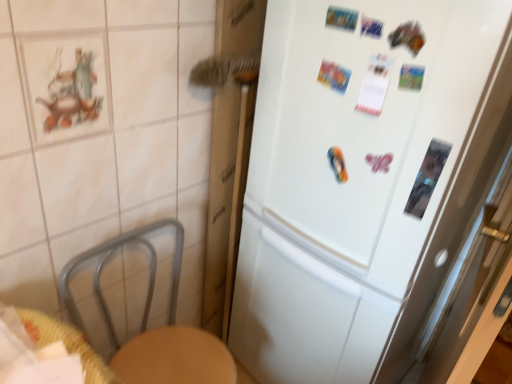
Measure the distance between transparent glass screen door at right and camera.

transparent glass screen door at right and camera are 72.40 centimeters apart from each other.

What do you see at coordinates (362, 177) in the screenshot? The height and width of the screenshot is (384, 512). I see `white matte refrigerator at center` at bounding box center [362, 177].

Locate an element on the screen. woven wood table at lower left is located at coordinates tap(66, 343).

You are a GUI agent. You are given a task and a screenshot of the screen. Output one action in this format:
    pyautogui.click(x=<x>, y=<y>)
    Task: Click on the transparent glass screen door at right
    The width and height of the screenshot is (512, 384).
    Given the screenshot: What is the action you would take?
    pyautogui.click(x=471, y=280)

Is woven wood table at lower left at the right side of transparent glass screen door at right?

No, woven wood table at lower left is not to the right of transparent glass screen door at right.

Does point (91, 367) appear closer or farther from the camera than point (457, 337)?

Point (91, 367) is closer to the camera than point (457, 337).

Is woven wood table at lower left far away from transparent glass screen door at right?

No, woven wood table at lower left is not far away from transparent glass screen door at right.

Considering the relative sizes of woven wood table at lower left and transparent glass screen door at right in the image provided, is woven wood table at lower left wider than transparent glass screen door at right?

Indeed, woven wood table at lower left has a greater width compared to transparent glass screen door at right.

How many degrees apart are the facing directions of transparent glass screen door at right and white matte refrigerator at center?

They differ by 108 degrees in their facing directions.

Is transparent glass screen door at right inside the boundaries of white matte refrigerator at center, or outside?

transparent glass screen door at right is not inside white matte refrigerator at center, it's outside.

Locate an element on the screen. screen door in front of the white matte refrigerator at center is located at coordinates pyautogui.click(x=471, y=280).

From a real-world perspective, does transparent glass screen door at right sit lower than white matte refrigerator at center?

Indeed, from a real-world perspective, transparent glass screen door at right is positioned beneath white matte refrigerator at center.

Would you say transparent glass screen door at right is a long distance from woven wood table at lower left?

They are positioned close to each other.

Do you think transparent glass screen door at right is within woven wood table at lower left, or outside of it?

transparent glass screen door at right is located beyond the bounds of woven wood table at lower left.

Does transparent glass screen door at right have a lesser height compared to woven wood table at lower left?

No.

Who is smaller, transparent glass screen door at right or woven wood table at lower left?

With smaller size is woven wood table at lower left.

Between white matte refrigerator at center and woven wood table at lower left, which one appears on the left side from the viewer's perspective?

woven wood table at lower left.

Where is `refrigerator that appears behind the woven wood table at lower left`? refrigerator that appears behind the woven wood table at lower left is located at coordinates (362, 177).

Considering the sizes of objects white matte refrigerator at center and woven wood table at lower left in the image provided, who is wider, white matte refrigerator at center or woven wood table at lower left?

white matte refrigerator at center.

Can you confirm if woven wood table at lower left is wider than white matte refrigerator at center?

No.

In the scene shown: From a real-world perspective, who is located lower, woven wood table at lower left or white matte refrigerator at center?

From a 3D spatial view, white matte refrigerator at center is below.

Which object is further away from the camera taking this photo, woven wood table at lower left or white matte refrigerator at center?

Positioned behind is white matte refrigerator at center.

How different are the orientations of woven wood table at lower left and white matte refrigerator at center in degrees?

The angular difference between woven wood table at lower left and white matte refrigerator at center is 96 degrees.

Is point (500, 14) farther from camera compared to point (507, 163)?

No, (500, 14) is in front of (507, 163).

Considering the relative sizes of white matte refrigerator at center and transparent glass screen door at right in the image provided, is white matte refrigerator at center taller than transparent glass screen door at right?

Yes.

Could transparent glass screen door at right be considered to be inside white matte refrigerator at center?

No.

Are white matte refrigerator at center and transparent glass screen door at right making contact?

No, white matte refrigerator at center is not beside transparent glass screen door at right.

Find the location of a particular element. The image size is (512, 384). screen door that appears below the woven wood table at lower left (from the image's perspective) is located at coordinates (471, 280).

At what (x,y) coordinates should I click in order to perform the action: click on refrigerator located above the transparent glass screen door at right (from the image's perspective). Please return your answer as a coordinate pair (x, y). This screenshot has width=512, height=384. Looking at the image, I should click on pos(362,177).

Considering their positions, is transparent glass screen door at right positioned closer to white matte refrigerator at center than woven wood table at lower left?

transparent glass screen door at right lies closer to white matte refrigerator at center than the other object.

From the image, which object appears to be farther from woven wood table at lower left, transparent glass screen door at right or white matte refrigerator at center?

transparent glass screen door at right lies further to woven wood table at lower left than the other object.

Looking at the image, which one is located further to transparent glass screen door at right, white matte refrigerator at center or woven wood table at lower left?

woven wood table at lower left.

From the picture: Looking at the image, which one is located closer to woven wood table at lower left, white matte refrigerator at center or transparent glass screen door at right?

white matte refrigerator at center is closer to woven wood table at lower left.

Estimate the real-world distances between objects in this image. Which object is further from white matte refrigerator at center, woven wood table at lower left or transparent glass screen door at right?

Among the two, woven wood table at lower left is located further to white matte refrigerator at center.

Looking at the image, which one is located further to transparent glass screen door at right, woven wood table at lower left or white matte refrigerator at center?

The object further to transparent glass screen door at right is woven wood table at lower left.

The image size is (512, 384). What are the coordinates of `refrigerator located between woven wood table at lower left and transparent glass screen door at right in the left-right direction` in the screenshot? It's located at (362, 177).